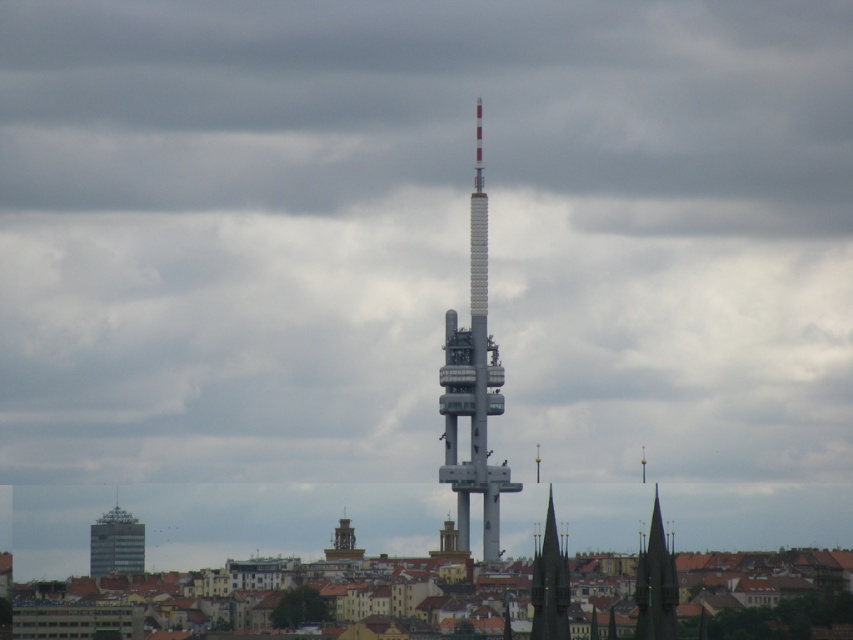
You are a city planner assessing the skyline. You notice the dark green stone spire at lower right and the matte gray building at lower left. Which structure appears bigger in the scene?

The dark green stone spire at lower right is larger in size than the matte gray building at lower left, so it appears bigger in the scene.

You are a city planner assessing the feasibility of installing a new 50 meter tall communication tower between the matte gray building at lower left and the golden stone clock tower at center. Based on the distance between them, will there be enough space for the tower without violating the city ordinance that requires a minimum 50 meter setback from any existing building?

The distance between the matte gray building at lower left and the golden stone clock tower at center is 44.94 meters. Since the required setback is 50 meters, the proposed 50 meter tall tower would not comply with the ordinance as the distance is less than the required setback. Therefore, the installation would violate the city ordinance.